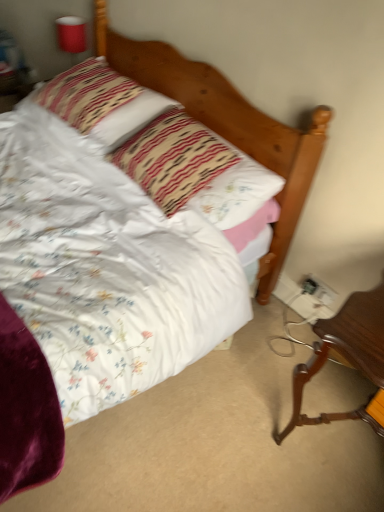
Question: Is floral fabric pillow at center, the first pillow positioned from the front, at the left side of white plastic electrical outlet at lower right, which is the second electric outlet in right-to-left order?

Choices:
 (A) no
 (B) yes

Answer: (B)

Question: Is floral fabric pillow at center, the first pillow positioned from the front, behind white plastic electrical outlet at lower right, which is the second electric outlet in right-to-left order?

Choices:
 (A) no
 (B) yes

Answer: (A)

Question: Considering the relative sizes of floral fabric pillow at center, the first pillow positioned from the front, and white plastic electrical outlet at lower right, arranged as the first electric outlet when viewed from the left, in the image provided, is floral fabric pillow at center, the first pillow positioned from the front, shorter than white plastic electrical outlet at lower right, arranged as the first electric outlet when viewed from the left,?

Choices:
 (A) no
 (B) yes

Answer: (A)

Question: Does floral fabric pillow at center, positioned as the second pillow in back-to-front order, lie in front of white plastic electrical outlet at lower right, which is the second electric outlet in right-to-left order?

Choices:
 (A) no
 (B) yes

Answer: (B)

Question: Does floral fabric pillow at center, positioned as the second pillow in back-to-front order, have a lesser width compared to white plastic electrical outlet at lower right, which is the second electric outlet in right-to-left order?

Choices:
 (A) yes
 (B) no

Answer: (B)

Question: Is brown polished wood desk at lower right inside the boundaries of floral fabric pillow at center, positioned as the second pillow in back-to-front order, or outside?

Choices:
 (A) inside
 (B) outside

Answer: (B)

Question: Relative to floral fabric pillow at center, positioned as the second pillow in back-to-front order, is brown polished wood desk at lower right in front or behind?

Choices:
 (A) front
 (B) behind

Answer: (A)

Question: From a real-world perspective, is brown polished wood desk at lower right above or below floral fabric pillow at center, positioned as the second pillow in back-to-front order?

Choices:
 (A) above
 (B) below

Answer: (B)

Question: Based on their positions, is brown polished wood desk at lower right located to the left or right of floral fabric pillow at center, positioned as the second pillow in back-to-front order?

Choices:
 (A) right
 (B) left

Answer: (A)

Question: Considering their positions, is red plastic cup at upper left located in front of or behind striped fabric pillow at upper left, which is counted as the 1th pillow, starting from the back?

Choices:
 (A) behind
 (B) front

Answer: (A)

Question: From a real-world perspective, is red plastic cup at upper left above or below striped fabric pillow at upper left, acting as the second pillow starting from the front?

Choices:
 (A) above
 (B) below

Answer: (B)

Question: Looking at their shapes, would you say red plastic cup at upper left is wider or thinner than striped fabric pillow at upper left, which is counted as the 1th pillow, starting from the back?

Choices:
 (A) wide
 (B) thin

Answer: (B)

Question: In terms of height, does red plastic cup at upper left look taller or shorter compared to striped fabric pillow at upper left, acting as the second pillow starting from the front?

Choices:
 (A) tall
 (B) short

Answer: (A)

Question: Is striped fabric pillow at upper left, which is counted as the 1th pillow, starting from the back, wider or thinner than brown polished wood desk at lower right?

Choices:
 (A) thin
 (B) wide

Answer: (A)

Question: Considering the positions of striped fabric pillow at upper left, which is counted as the 1th pillow, starting from the back, and brown polished wood desk at lower right in the image, is striped fabric pillow at upper left, which is counted as the 1th pillow, starting from the back, taller or shorter than brown polished wood desk at lower right?

Choices:
 (A) tall
 (B) short

Answer: (B)